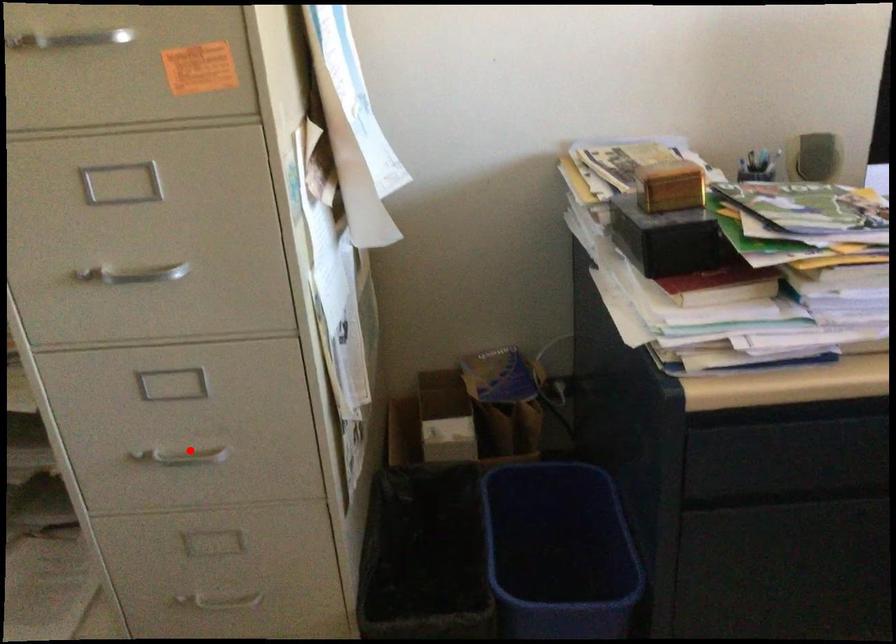
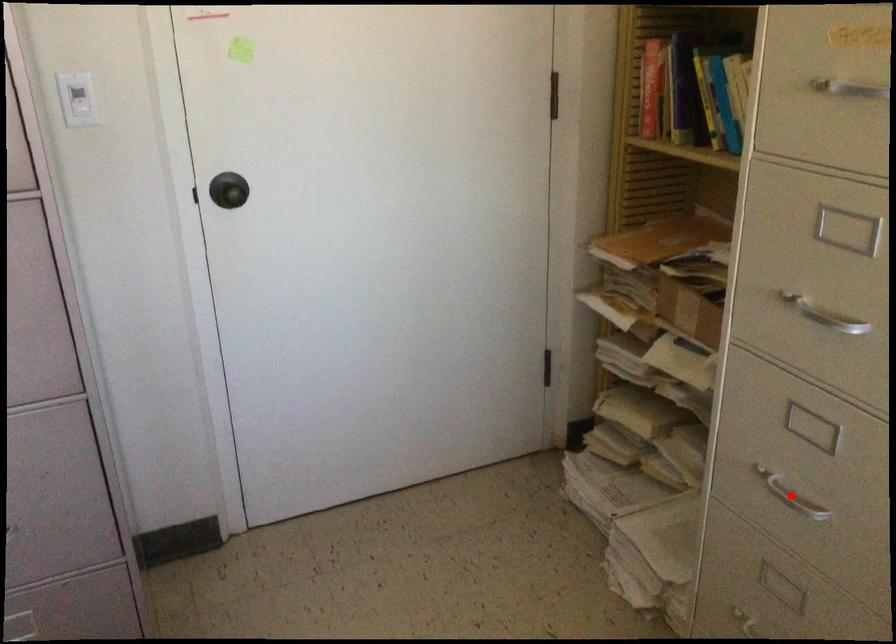
I am providing you with two images of the same scene from different viewpoints. A red point is marked on the first image and another point is marked on the second image. Does the point marked in image1 correspond to the same location as the one in image2?

Yes